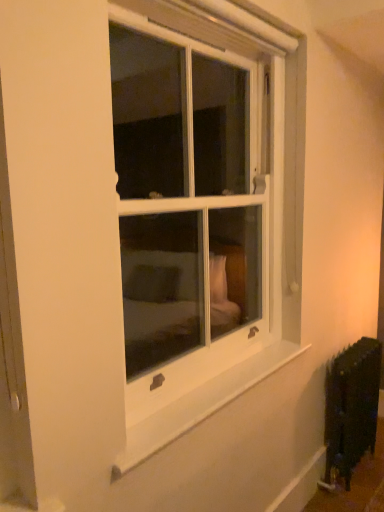
Question: Is black matte radiator at lower right to the left or to the right of white smooth window sill at lower center in the image?

Choices:
 (A) left
 (B) right

Answer: (B)

Question: From a real-world perspective, is black matte radiator at lower right physically located above or below white smooth window sill at lower center?

Choices:
 (A) above
 (B) below

Answer: (B)

Question: Which of these objects is positioned closest to the white glass window at center?

Choices:
 (A) black matte radiator at lower right
 (B) white smooth window sill at lower center

Answer: (A)

Question: Estimate the real-world distances between objects in this image. Which object is closer to the white glass window at center?

Choices:
 (A) black matte radiator at lower right
 (B) white smooth window sill at lower center

Answer: (A)